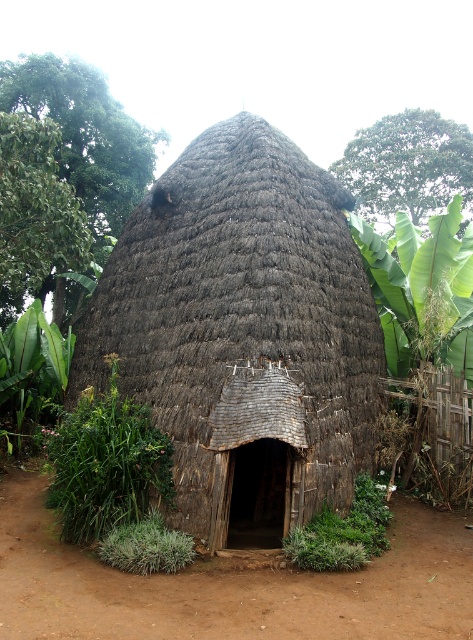
Question: Is brown dirt field at center above green leafy plant at center?

Choices:
 (A) no
 (B) yes

Answer: (A)

Question: Which object appears closest to the camera in this image?

Choices:
 (A) brown dirt field at center
 (B) brown thatch hut at center

Answer: (A)

Question: Which point appears closest to the camera in this image?

Choices:
 (A) (348, 556)
 (B) (402, 550)

Answer: (A)

Question: Does green leafy plant at center lie behind green leafy plant at lower left?

Choices:
 (A) no
 (B) yes

Answer: (B)

Question: Which object appears closest to the camera in this image?

Choices:
 (A) brown thatch hut at center
 (B) brown dirt field at center

Answer: (B)

Question: Is green leafy plant at center positioned in front of green leafy plant at lower left?

Choices:
 (A) yes
 (B) no

Answer: (B)